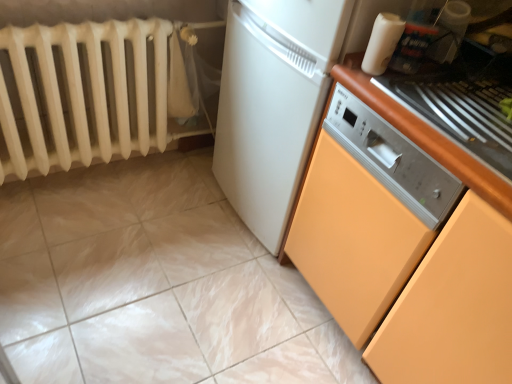
Question: Considering the positions of white matte radiator at left and white glossy tile at lower center in the image, is white matte radiator at left bigger or smaller than white glossy tile at lower center?

Choices:
 (A) big
 (B) small

Answer: (A)

Question: From a real-world perspective, is white matte radiator at left physically located above or below white glossy tile at lower center?

Choices:
 (A) above
 (B) below

Answer: (A)

Question: Which is farther from the white glossy dishwasher at center?

Choices:
 (A) white glossy tile at lower center
 (B) orange matte cabinet at right
 (C) orange matte countertop at right
 (D) white glossy plastic container at upper right
 (E) white matte radiator at left

Answer: (A)

Question: Estimate the real-world distances between objects in this image. Which object is closer to the white matte radiator at left?

Choices:
 (A) white glossy plastic container at upper right
 (B) white glossy dishwasher at center
 (C) orange matte cabinet at right
 (D) white glossy tile at lower center
 (E) orange matte countertop at right

Answer: (D)